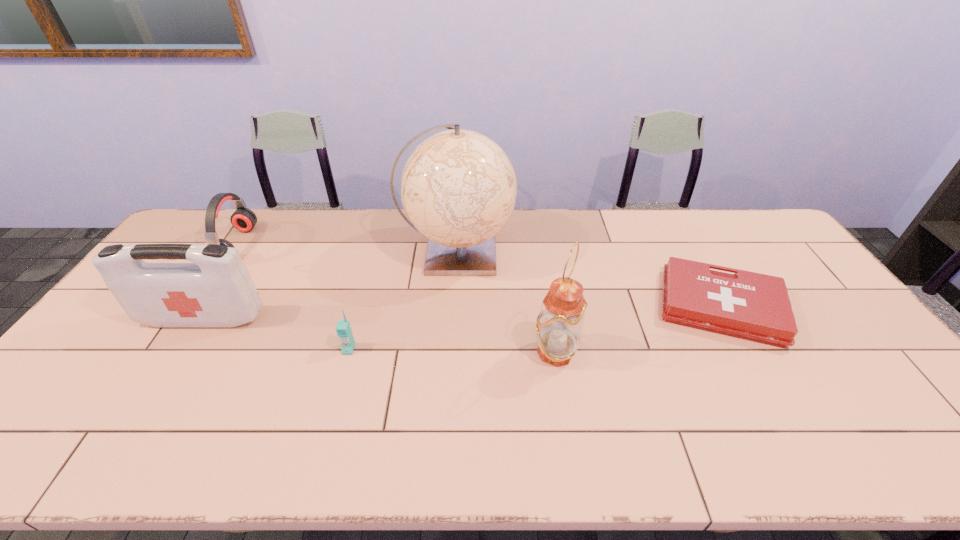
Locate an element on the screen. object at the right edge is located at coordinates (747, 305).

Image resolution: width=960 pixels, height=540 pixels. I want to click on free space at the far edge, so click(632, 231).

This screenshot has height=540, width=960. I want to click on vacant position at the near edge of the desktop, so click(x=860, y=465).

In the image, there is a desktop. Where is `vacant space at the near left corner`? vacant space at the near left corner is located at coordinates (24, 433).

The image size is (960, 540). Find the location of `blank region between the fifth tallest object and the second object from right to left`. blank region between the fifth tallest object and the second object from right to left is located at coordinates (452, 350).

Find the location of a particular element. Image resolution: width=960 pixels, height=540 pixels. empty location between the left first-aid kit and the shortest object is located at coordinates click(x=462, y=313).

At what (x,y) coordinates should I click in order to perform the action: click on vacant space in between the fifth object from left to right and the cellular telephone. Please return your answer as a coordinate pair (x, y). This screenshot has height=540, width=960. Looking at the image, I should click on (452, 350).

Where is `empty location between the tallest object and the right first-aid kit`? The image size is (960, 540). empty location between the tallest object and the right first-aid kit is located at coordinates (588, 280).

This screenshot has height=540, width=960. I want to click on vacant point located between the second tallest object and the tallest object, so click(x=506, y=302).

Where is `free space that is in between the oil lamp and the earphone`? The image size is (960, 540). free space that is in between the oil lamp and the earphone is located at coordinates (396, 298).